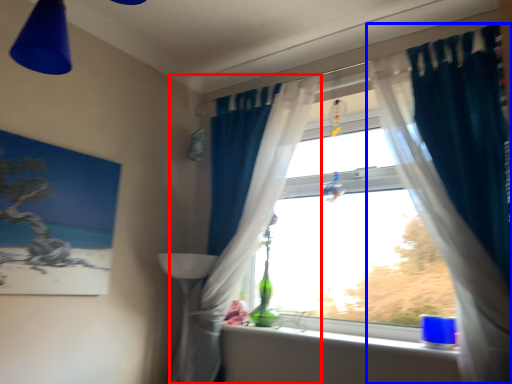
Question: Which object appears closest to the camera in this image, curtain (highlighted by a red box) or curtain (highlighted by a blue box)?

Choices:
 (A) curtain
 (B) curtain

Answer: (B)